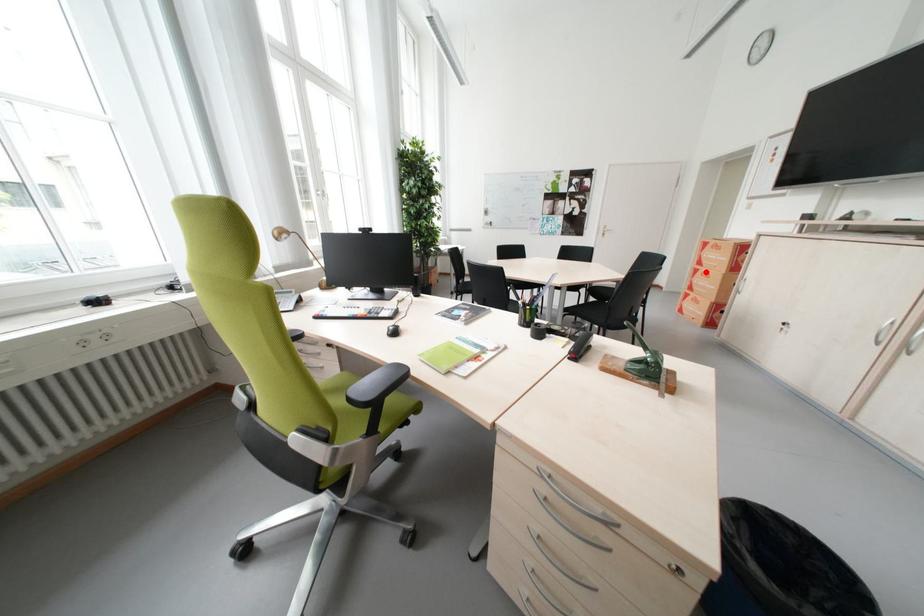
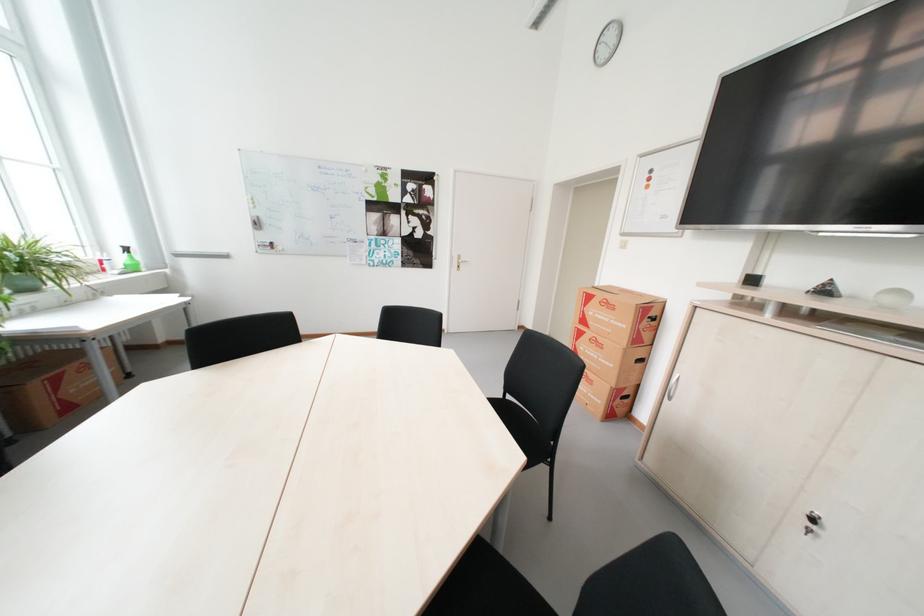
Question: I am providing you with two images of the same scene from different viewpoints. In image1, a red point is highlighted. Considering the same 3D point in image2, which of the following is correct?

Choices:
 (A) It is closer
 (B) It is farther

Answer: (A)